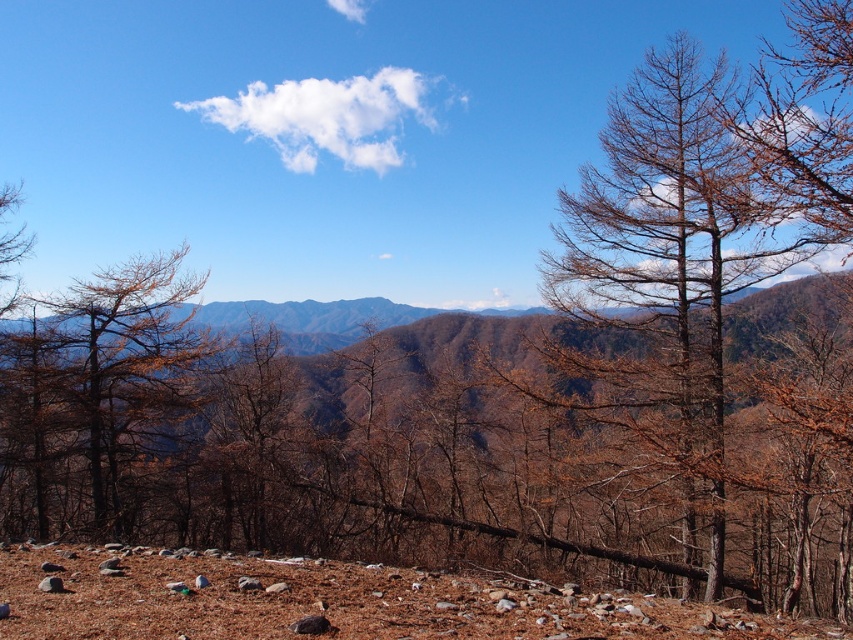
Is point (625, 328) farther from viewer compared to point (71, 376)?

No, it is in front of (71, 376).

Who is more forward, (x=683, y=244) or (x=122, y=465)?

Positioned in front is point (x=683, y=244).

Identify the location of brown/dried bark tree at right. (689, 250).